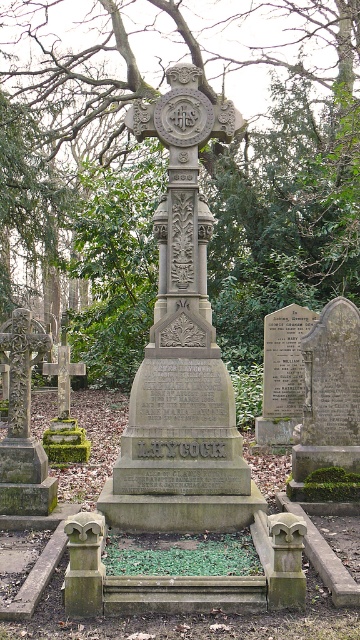
What do you see at coordinates (182, 349) in the screenshot?
I see `gray stone cross at center` at bounding box center [182, 349].

This screenshot has width=360, height=640. Find the location of `gray stone cross at center`. gray stone cross at center is located at coordinates (182, 349).

Does green leafy tree at center have a larger size compared to green mossy cross at left?

Yes.

Is green leafy tree at center shorter than green mossy cross at left?

In fact, green leafy tree at center may be taller than green mossy cross at left.

You are a GUI agent. You are given a task and a screenshot of the screen. Output one action in this format:
    pyautogui.click(x=<x>, y=<y>)
    Task: Click on the green leafy tree at center
    The width and height of the screenshot is (360, 640).
    Given the screenshot: What is the action you would take?
    pyautogui.click(x=165, y=168)

At what (x,y) coordinates should I click in order to perform the action: click on green leafy tree at center. Please return your answer as a coordinate pair (x, y). The width and height of the screenshot is (360, 640). Looking at the image, I should click on (165, 168).

Can you confirm if green leafy tree at center is wider than gray stone cross at center?

Yes, green leafy tree at center is wider than gray stone cross at center.

Is green leafy tree at center further to camera compared to gray stone cross at center?

Yes, it is behind gray stone cross at center.

Which is behind, point (266, 250) or point (204, 440)?

Positioned behind is point (266, 250).

I want to click on green leafy tree at center, so click(165, 168).